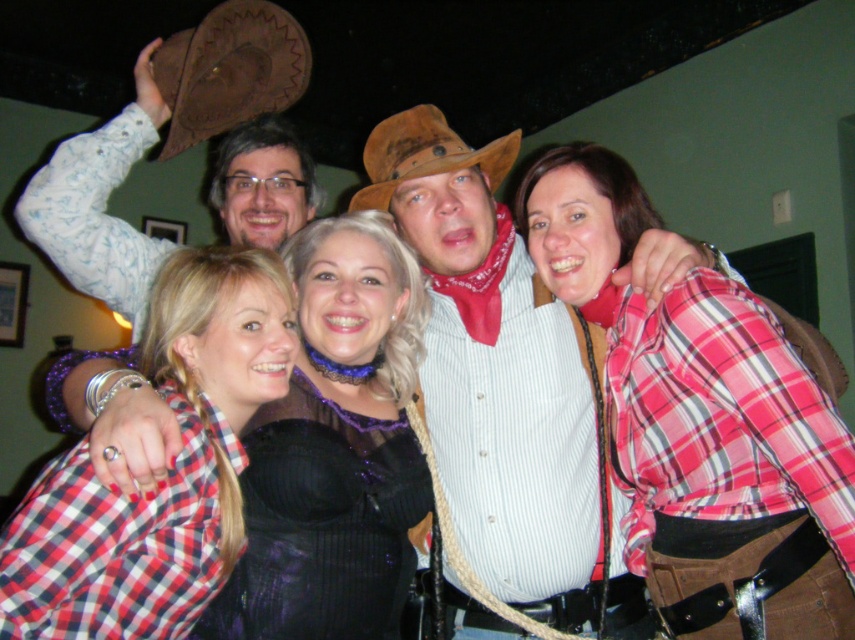
Question: Does black sequined dress at center have a smaller size compared to brown leather cowboy hat at upper left?

Choices:
 (A) no
 (B) yes

Answer: (B)

Question: Which point appears closest to the camera in this image?

Choices:
 (A) (575, 392)
 (B) (706, 609)

Answer: (B)

Question: Which point is closer to the camera?

Choices:
 (A) (677, 241)
 (B) (248, 451)

Answer: (A)

Question: Among these objects, which one is nearest to the camera?

Choices:
 (A) brown leather cowboy hat at center
 (B) matte brown cowboy hat at center
 (C) plaid cotton shirt at center
 (D) checkered fabric shirt at lower left

Answer: (C)

Question: Does plaid cotton shirt at center come behind brown leather cowboy hat at center?

Choices:
 (A) no
 (B) yes

Answer: (A)

Question: Can you confirm if plaid cotton shirt at center is wider than black sequined dress at center?

Choices:
 (A) no
 (B) yes

Answer: (B)